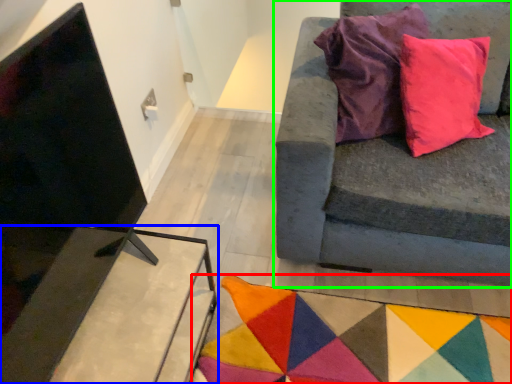
Question: Which is nearer to the mat (highlighted by a red box)? table (highlighted by a blue box) or studio couch (highlighted by a green box).

Choices:
 (A) table
 (B) studio couch

Answer: (B)